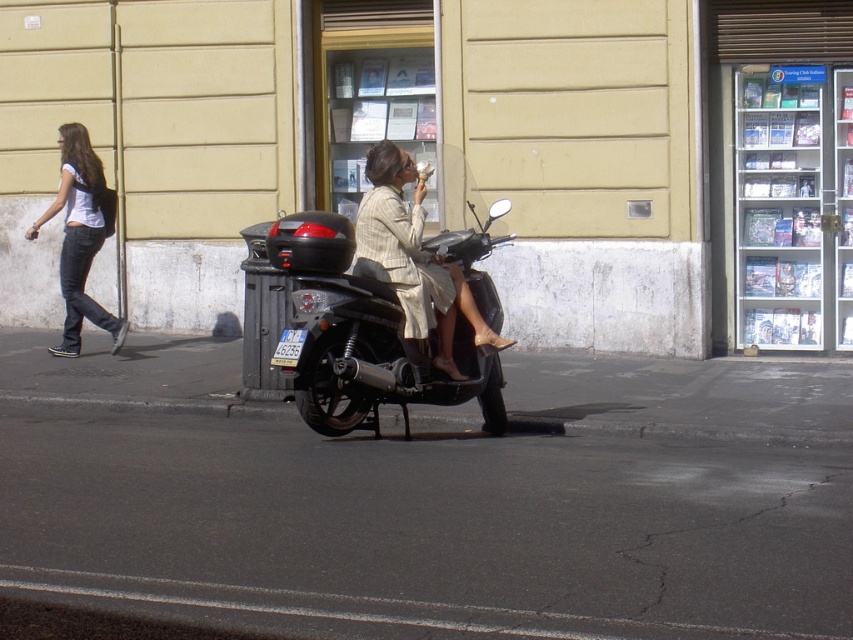
You are a fashion designer observing the scene. You notice the matte beige dress at center and denim jeans at left. Which clothing item is positioned lower on the person?

The matte beige dress at center is located below denim jeans at left, so the matte beige dress at center is positioned lower on the person.

You are planning to park your vehicle in a narrow alleyway that can only accommodate items as wide as the denim jeans at left. Based on the scene, will the shiny black scooter at center fit in the alleyway?

The shiny black scooter at center is wider than the denim jeans at left, so it will not fit in the alleyway designed for items as wide as the denim jeans at left.

You are a delivery person who needs to quickly move the shiny black scooter at center without disturbing the matte beige dress at center. Can you move the scooter sideways by 10 inches?

The shiny black scooter at center is 12.33 inches away from the matte beige dress at center. Since 12.33 inches is more than 10 inches, moving the scooter sideways by 10 inches would not disturb the matte beige dress at center.